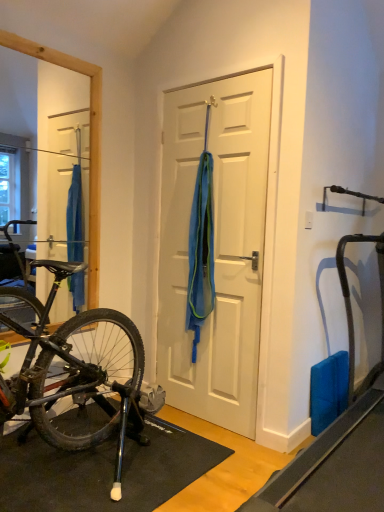
You are a GUI agent. You are given a task and a screenshot of the screen. Output one action in this format:
    pyautogui.click(x=<x>, y=<y>)
    Task: Click on the vacant space in front of white matte door at center
    This screenshot has width=384, height=512.
    Given the screenshot: What is the action you would take?
    pyautogui.click(x=226, y=444)